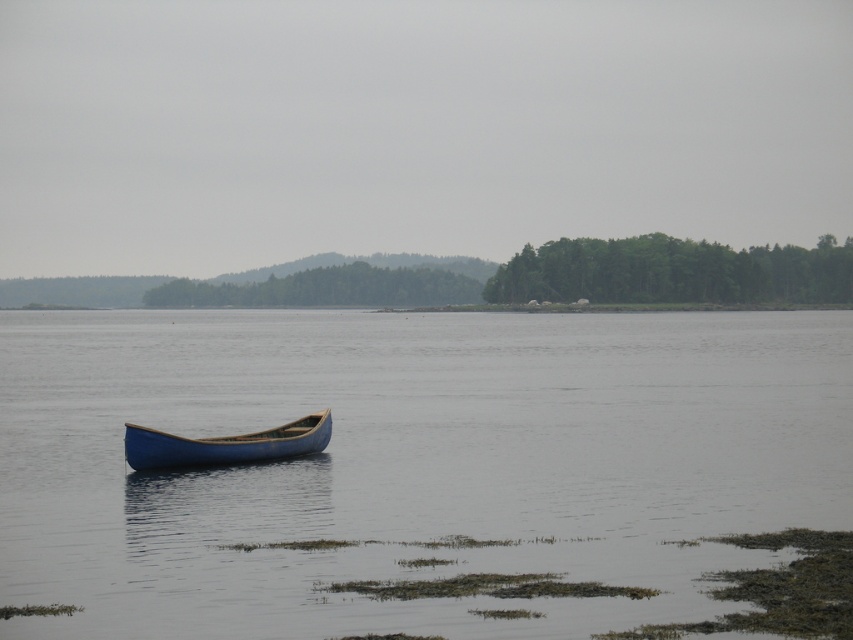
Question: Does blue smooth water at center appear under blue wooden canoe at center?

Choices:
 (A) no
 (B) yes

Answer: (A)

Question: Can you confirm if blue smooth water at center is positioned to the left of blue wooden canoe at center?

Choices:
 (A) yes
 (B) no

Answer: (B)

Question: Which point appears closest to the camera in this image?

Choices:
 (A) (223, 442)
 (B) (476, 620)

Answer: (B)

Question: Among these objects, which one is farthest from the camera?

Choices:
 (A) blue smooth water at center
 (B) blue wooden canoe at center

Answer: (B)

Question: Can you confirm if blue smooth water at center is positioned to the right of blue wooden canoe at center?

Choices:
 (A) no
 (B) yes

Answer: (B)